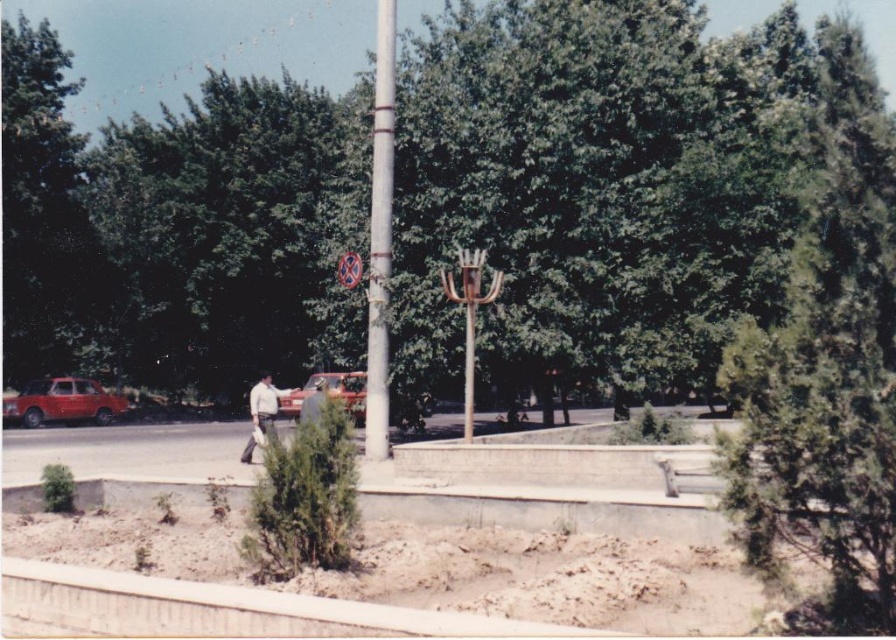
Is white cotton shirt at center shorter than gray fabric jacket at center?

Incorrect, white cotton shirt at center's height does not fall short of gray fabric jacket at center's.

Does point (242, 461) lie behind point (312, 396)?

Yes, it is.

In order to click on white cotton shirt at center in this screenshot , I will do `click(263, 412)`.

Which of these two, metallic pole at center or gray fabric jacket at center, stands taller?

metallic pole at center

Is metallic pole at center thinner than gray fabric jacket at center?

Indeed, metallic pole at center has a lesser width compared to gray fabric jacket at center.

You are a GUI agent. You are given a task and a screenshot of the screen. Output one action in this format:
    pyautogui.click(x=<x>, y=<y>)
    Task: Click on the metallic pole at center
    
    Given the screenshot: What is the action you would take?
    pyautogui.click(x=468, y=369)

Which is behind, point (85, 385) or point (364, 371)?

Positioned behind is point (85, 385).

Can you confirm if matte red car at left is thinner than metallic red car at center?

Correct, matte red car at left's width is less than metallic red car at center's.

Describe the element at coordinates (62, 403) in the screenshot. I see `matte red car at left` at that location.

I want to click on matte red car at left, so click(62, 403).